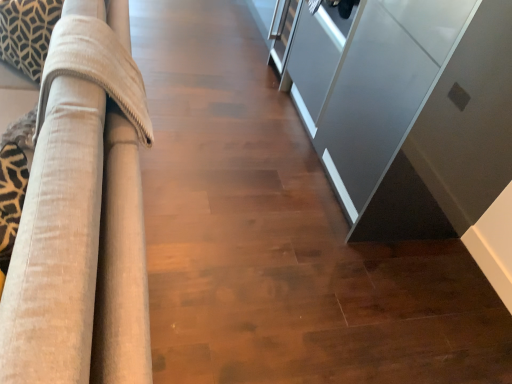
From the picture: What is the approximate height of patterned fabric pillow at upper left?

patterned fabric pillow at upper left is 16.78 inches in height.

The width and height of the screenshot is (512, 384). I want to click on beige fabric couch at left, so click(79, 250).

At what (x,y) coordinates should I click in order to perform the action: click on satin gray cabinet at right. Please return your answer as a coordinate pair (x, y). Looking at the image, I should click on (380, 89).

Considering the sizes of objects beige fabric couch at left and satin gray cabinet at right in the image provided, who is bigger, beige fabric couch at left or satin gray cabinet at right?

beige fabric couch at left is bigger.

Looking at this image, from the image's perspective, is beige fabric couch at left above satin gray cabinet at right?

Yes, from the image's perspective, beige fabric couch at left is above satin gray cabinet at right.

Is beige fabric couch at left next to satin gray cabinet at right?

No.

Which of these two, patterned fabric pillow at upper left or satin gray cabinet at right, is bigger?

satin gray cabinet at right is bigger.

From a real-world perspective, is patterned fabric pillow at upper left physically located above or below satin gray cabinet at right?

In terms of real-world spatial position, patterned fabric pillow at upper left is above satin gray cabinet at right.

Which of these two, patterned fabric pillow at upper left or satin gray cabinet at right, stands taller?

Standing taller between the two is satin gray cabinet at right.

Is there a large distance between patterned fabric pillow at upper left and satin gray cabinet at right?

patterned fabric pillow at upper left is far away from satin gray cabinet at right.

Between satin gray cabinet at right and beige fabric couch at left, which one has smaller size?

satin gray cabinet at right.

Between satin gray cabinet at right and beige fabric couch at left, which one has less height?

With less height is beige fabric couch at left.

Looking at this image, is satin gray cabinet at right at the right side of beige fabric couch at left?

Correct, you'll find satin gray cabinet at right to the right of beige fabric couch at left.

Can you confirm if satin gray cabinet at right is thinner than beige fabric couch at left?

Yes, satin gray cabinet at right is thinner than beige fabric couch at left.

Is patterned fabric pillow at upper left next to beige fabric couch at left?

No, patterned fabric pillow at upper left is not beside beige fabric couch at left.

Does patterned fabric pillow at upper left come in front of beige fabric couch at left?

No, the depth of patterned fabric pillow at upper left is greater than that of beige fabric couch at left.

You are a GUI agent. You are given a task and a screenshot of the screen. Output one action in this format:
    pyautogui.click(x=<x>, y=<y>)
    Task: Click on the pillow positioned vertically above the beige fabric couch at left (from a real-world perspective)
    The image size is (512, 384).
    Given the screenshot: What is the action you would take?
    pyautogui.click(x=27, y=33)

Which point is more distant from viewer, (29, 26) or (99, 125)?

The point (29, 26) is farther from the camera.

Is beige fabric couch at left bigger than patterned fabric pillow at upper left?

Indeed, beige fabric couch at left has a larger size compared to patterned fabric pillow at upper left.

Considering the relative sizes of beige fabric couch at left and patterned fabric pillow at upper left in the image provided, is beige fabric couch at left taller than patterned fabric pillow at upper left?

Correct, beige fabric couch at left is much taller as patterned fabric pillow at upper left.

Does beige fabric couch at left turn towards patterned fabric pillow at upper left?

Yes, beige fabric couch at left is aimed at patterned fabric pillow at upper left.

Is beige fabric couch at left with patterned fabric pillow at upper left?

No, beige fabric couch at left is not in contact with patterned fabric pillow at upper left.

Looking at the image, does satin gray cabinet at right seem bigger or smaller compared to patterned fabric pillow at upper left?

Considering their sizes, satin gray cabinet at right takes up more space than patterned fabric pillow at upper left.

From a real-world perspective, is satin gray cabinet at right beneath patterned fabric pillow at upper left?

Yes, from a real-world perspective, satin gray cabinet at right is beneath patterned fabric pillow at upper left.

How many degrees apart are the facing directions of satin gray cabinet at right and patterned fabric pillow at upper left?

45.6 degrees.

The height and width of the screenshot is (384, 512). What are the coordinates of `furniture that appears on the left of satin gray cabinet at right` in the screenshot? It's located at (79, 250).

You are a GUI agent. You are given a task and a screenshot of the screen. Output one action in this format:
    pyautogui.click(x=<x>, y=<y>)
    Task: Click on the glass door beneath the patterned fabric pillow at upper left (from a real-world perspective)
    
    Given the screenshot: What is the action you would take?
    pyautogui.click(x=380, y=89)

Based on their spatial positions, is satin gray cabinet at right or patterned fabric pillow at upper left closer to beige fabric couch at left?

patterned fabric pillow at upper left.

Considering their positions, is beige fabric couch at left positioned further to satin gray cabinet at right than patterned fabric pillow at upper left?

patterned fabric pillow at upper left is positioned further to the anchor satin gray cabinet at right.

Estimate the real-world distances between objects in this image. Which object is further from patterned fabric pillow at upper left, beige fabric couch at left or satin gray cabinet at right?

satin gray cabinet at right lies further to patterned fabric pillow at upper left than the other object.

Considering their positions, is satin gray cabinet at right positioned closer to patterned fabric pillow at upper left than beige fabric couch at left?

beige fabric couch at left is closer to patterned fabric pillow at upper left.

Considering their positions, is patterned fabric pillow at upper left positioned further to satin gray cabinet at right than beige fabric couch at left?

patterned fabric pillow at upper left.

Based on their spatial positions, is patterned fabric pillow at upper left or satin gray cabinet at right closer to beige fabric couch at left?

patterned fabric pillow at upper left lies closer to beige fabric couch at left than the other object.

Identify the location of furniture between patterned fabric pillow at upper left and satin gray cabinet at right. This screenshot has height=384, width=512. (79, 250).